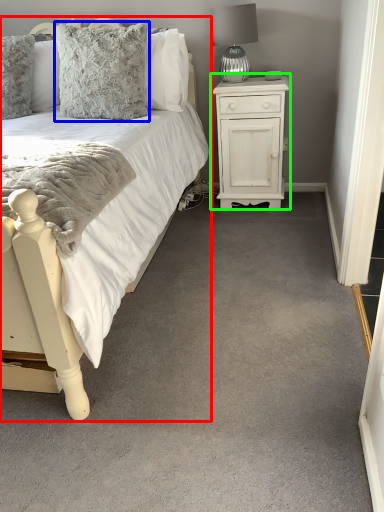
Question: Considering the real-world distances, which object is closest to bed (highlighted by a red box)? pillow (highlighted by a blue box) or nightstand (highlighted by a green box).

Choices:
 (A) pillow
 (B) nightstand

Answer: (A)